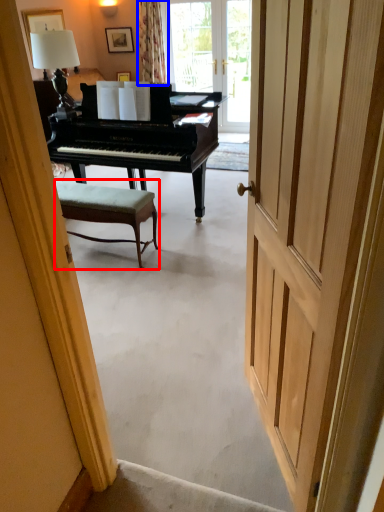
Question: Which point is closer to the camera, chair (highlighted by a red box) or curtain (highlighted by a blue box)?

Choices:
 (A) chair
 (B) curtain

Answer: (A)